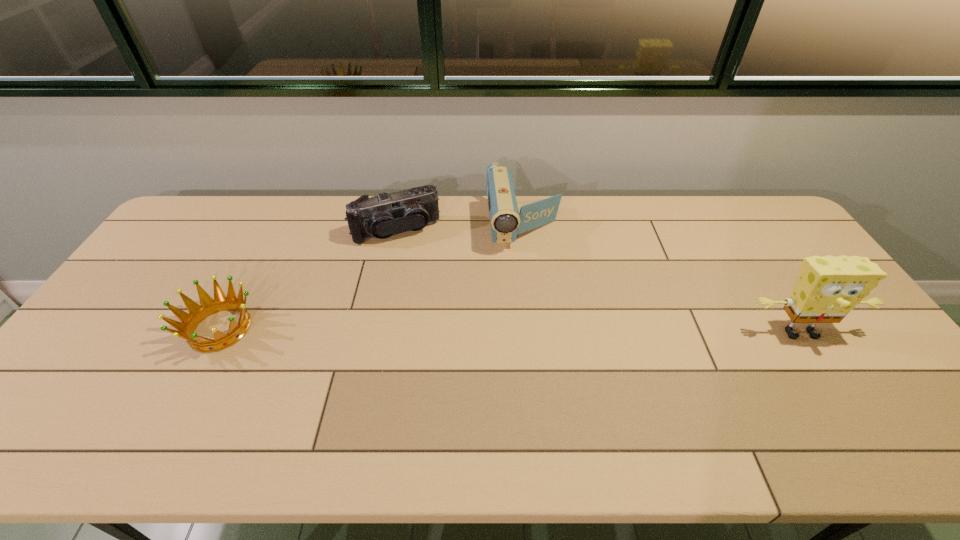
You are a GUI agent. You are given a task and a screenshot of the screen. Output one action in this format:
    pyautogui.click(x=<x>, y=<y>)
    Task: Click on the vacant space positioned 0.250m on the side of the taller camcorder with the flip-out screen
    The image size is (960, 540).
    Given the screenshot: What is the action you would take?
    pyautogui.click(x=540, y=319)

Identify the location of vacant position located 0.340m on the side of the taller camcorder with the flip-out screen. Image resolution: width=960 pixels, height=540 pixels. (545, 345).

You are a GUI agent. You are given a task and a screenshot of the screen. Output one action in this format:
    pyautogui.click(x=<x>, y=<y>)
    Task: Click on the free space located 0.230m on the side of the taller camcorder with the flip-out screen
    The width and height of the screenshot is (960, 540).
    Given the screenshot: What is the action you would take?
    pyautogui.click(x=540, y=313)

Where is `vacant space situated 0.140m on the front-facing side of the left camcorder`? Image resolution: width=960 pixels, height=540 pixels. vacant space situated 0.140m on the front-facing side of the left camcorder is located at coordinates (420, 274).

The image size is (960, 540). In order to click on vacant space positioned 0.050m on the front-facing side of the left camcorder in this screenshot , I will do click(413, 255).

The width and height of the screenshot is (960, 540). In order to click on vacant space located 0.140m on the front-facing side of the left camcorder in this screenshot , I will do `click(420, 274)`.

Locate an element on the screen. This screenshot has width=960, height=540. object that is at the right edge is located at coordinates (828, 288).

In the image, there is a desktop. Identify the location of vacant space at the far edge. (742, 238).

You are a GUI agent. You are given a task and a screenshot of the screen. Output one action in this format:
    pyautogui.click(x=<x>, y=<y>)
    Task: Click on the free space at the near edge
    This screenshot has height=540, width=960.
    Given the screenshot: What is the action you would take?
    pyautogui.click(x=514, y=380)

Where is `free region at the left edge`? The image size is (960, 540). free region at the left edge is located at coordinates (149, 280).